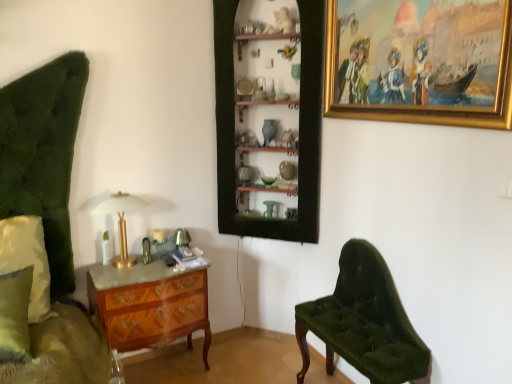
Where is `vacant space to the right of gold metallic table lamp at center`? The height and width of the screenshot is (384, 512). vacant space to the right of gold metallic table lamp at center is located at coordinates (153, 268).